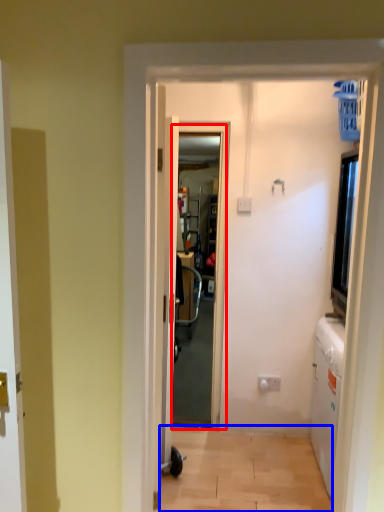
Question: Which of the following is the farthest to the observer, screen door (highlighted by a red box) or corridor (highlighted by a blue box)?

Choices:
 (A) screen door
 (B) corridor

Answer: (A)